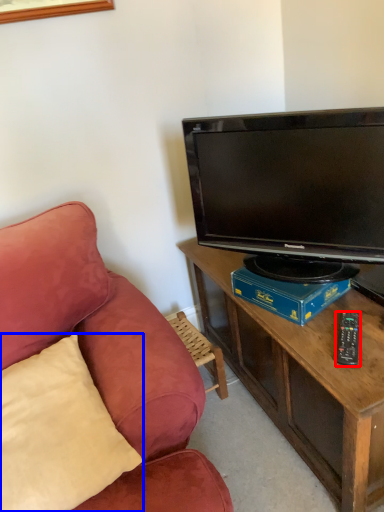
Question: Which point is closer to the camera, remote control (highlighted by a red box) or pillow (highlighted by a blue box)?

Choices:
 (A) remote control
 (B) pillow

Answer: (B)